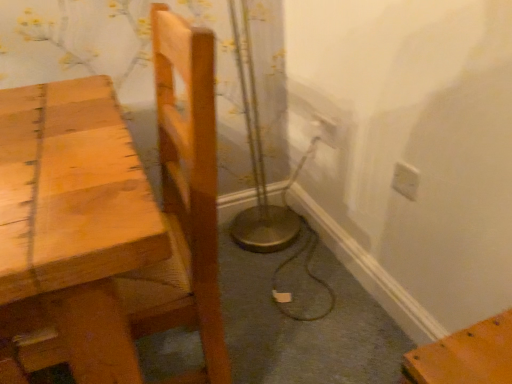
Question: Is there a large distance between white plastic electric outlet at upper right, acting as the 1th electric outlet starting from the left, and light brown wooden chair at left?

Choices:
 (A) yes
 (B) no

Answer: (B)

Question: Is white plastic electric outlet at upper right, which is counted as the 2th electric outlet, starting from the front, taller than light brown wooden chair at left?

Choices:
 (A) yes
 (B) no

Answer: (B)

Question: Is white plastic electric outlet at upper right, the first electric outlet positioned from the top, to the left of light brown wooden chair at left from the viewer's perspective?

Choices:
 (A) no
 (B) yes

Answer: (A)

Question: Does white plastic electric outlet at upper right, the first electric outlet positioned from the top, have a greater width compared to light brown wooden chair at left?

Choices:
 (A) yes
 (B) no

Answer: (B)

Question: Considering the relative sizes of white plastic electric outlet at upper right, the 2th electric outlet when ordered from bottom to top, and light brown wooden chair at left in the image provided, is white plastic electric outlet at upper right, the 2th electric outlet when ordered from bottom to top, thinner than light brown wooden chair at left?

Choices:
 (A) yes
 (B) no

Answer: (A)

Question: Based on their sizes in the image, would you say light brown wooden chair at left is bigger or smaller than white plastic electric outlet at upper right, the first electric outlet positioned from the top?

Choices:
 (A) small
 (B) big

Answer: (B)

Question: From a real-world perspective, is light brown wooden chair at left above or below white plastic electric outlet at upper right, the 2th electric outlet when ordered from bottom to top?

Choices:
 (A) above
 (B) below

Answer: (A)

Question: Looking at their shapes, would you say light brown wooden chair at left is wider or thinner than white plastic electric outlet at upper right, the second electric outlet positioned from the right?

Choices:
 (A) thin
 (B) wide

Answer: (B)

Question: Is point (188, 210) positioned closer to the camera than point (335, 127)?

Choices:
 (A) farther
 (B) closer

Answer: (B)

Question: In the image, is white plastic electric outlet at upper right, which is the 2th electric outlet in back-to-front order, on the left side or the right side of white plastic electric outlet at upper right, the first electric outlet in the back-to-front sequence?

Choices:
 (A) right
 (B) left

Answer: (A)

Question: In terms of size, does white plastic electric outlet at upper right, which is the 2th electric outlet in back-to-front order, appear bigger or smaller than white plastic electric outlet at upper right, the first electric outlet in the back-to-front sequence?

Choices:
 (A) small
 (B) big

Answer: (A)

Question: Which is correct: white plastic electric outlet at upper right, marked as the first electric outlet in a front-to-back arrangement, is inside white plastic electric outlet at upper right, the second electric outlet positioned from the right, or outside of it?

Choices:
 (A) inside
 (B) outside

Answer: (B)

Question: From the image's perspective, is white plastic electric outlet at upper right, placed as the 1th electric outlet when sorted from bottom to top, above or below white plastic electric outlet at upper right, acting as the 1th electric outlet starting from the left?

Choices:
 (A) below
 (B) above

Answer: (A)

Question: Does point (333, 142) appear closer or farther from the camera than point (145, 289)?

Choices:
 (A) farther
 (B) closer

Answer: (A)

Question: From the image's perspective, relative to light brown wooden chair at left, is white plastic electric outlet at upper right, the first electric outlet positioned from the top, above or below?

Choices:
 (A) below
 (B) above

Answer: (B)